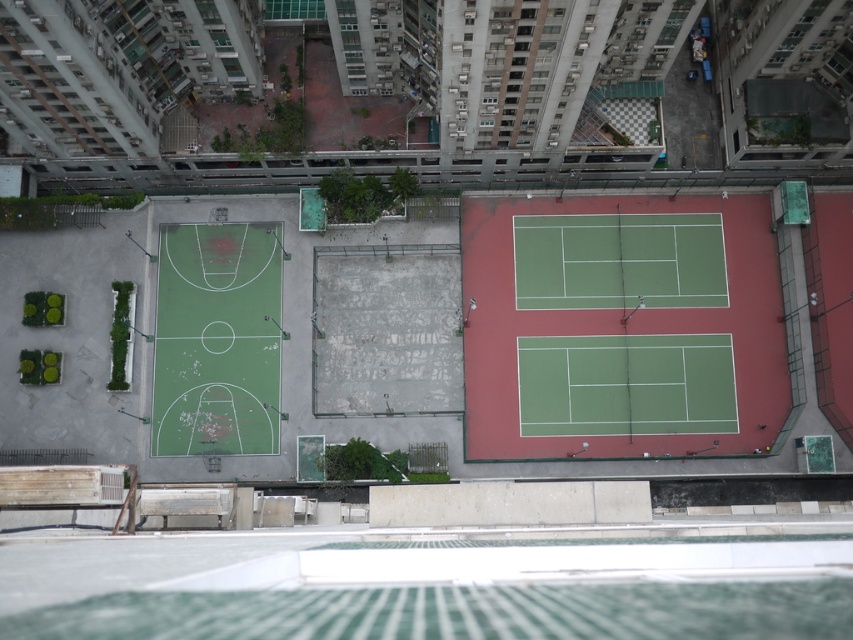
Between green rubber basketball court at center and matte green tennis racket at center, which one appears on the right side from the viewer's perspective?

From the viewer's perspective, matte green tennis racket at center appears more on the right side.

Between green rubber basketball court at center and matte green tennis racket at center, which one is positioned higher?

green rubber basketball court at center is above.

The width and height of the screenshot is (853, 640). Identify the location of green rubber basketball court at center. (618, 260).